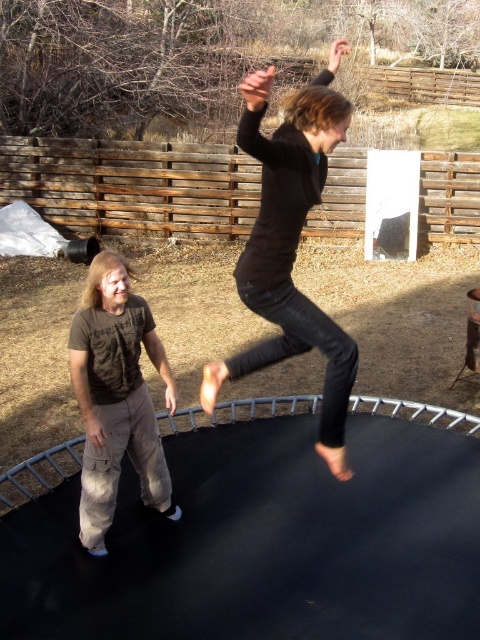
Question: Considering the relative positions of black matte jeans at center and brown cotton shirt at left in the image provided, where is black matte jeans at center located with respect to brown cotton shirt at left?

Choices:
 (A) above
 (B) below

Answer: (A)

Question: Which point is farther to the camera?

Choices:
 (A) (264, 348)
 (B) (101, 317)

Answer: (A)

Question: Observing the image, what is the correct spatial positioning of black matte jeans at center in reference to brown cotton shirt at left?

Choices:
 (A) right
 (B) left

Answer: (A)

Question: Is black matte jeans at center to the left of brown cotton shirt at left from the viewer's perspective?

Choices:
 (A) no
 (B) yes

Answer: (A)